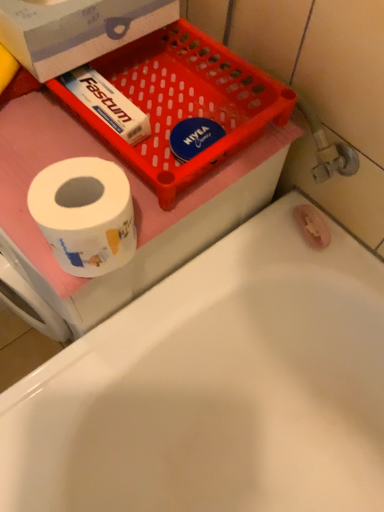
Question: Relative to white glossy toilet paper at left, is red plastic tray at upper left in front or behind?

Choices:
 (A) behind
 (B) front

Answer: (A)

Question: From the image's perspective, is red plastic tray at upper left located above or below white glossy toilet paper at left?

Choices:
 (A) below
 (B) above

Answer: (B)

Question: Which object is the closest to the red plastic tray at upper left?

Choices:
 (A) white cardboard box at upper left
 (B) white glossy toilet paper at left
 (C) white glossy bathtub at lower left

Answer: (A)

Question: Estimate the real-world distances between objects in this image. Which object is closer to the white glossy toilet paper at left?

Choices:
 (A) red plastic tray at upper left
 (B) white cardboard box at upper left
 (C) white glossy bathtub at lower left

Answer: (A)